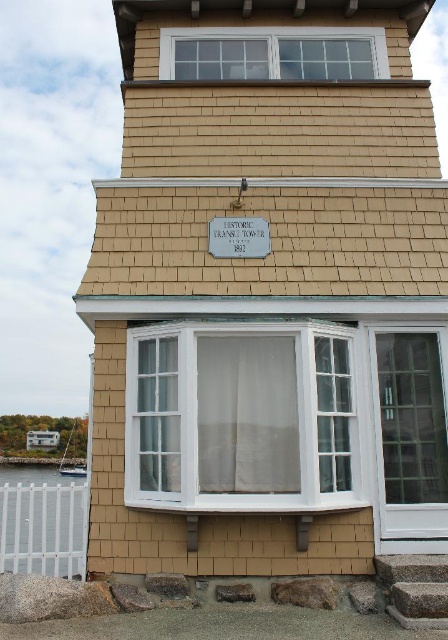
Question: Is white glass window at upper center to the left of white plastic fence at lower left from the viewer's perspective?

Choices:
 (A) no
 (B) yes

Answer: (A)

Question: Is white glass window at center bigger than white plastic fence at lower left?

Choices:
 (A) yes
 (B) no

Answer: (B)

Question: Which of the following is the closest to the observer?

Choices:
 (A) (276, 33)
 (B) (142, 477)
 (C) (72, 568)

Answer: (C)

Question: Does white glass window at center have a larger size compared to white plastic fence at lower left?

Choices:
 (A) no
 (B) yes

Answer: (A)

Question: Which object is the farthest from the white plastic fence at lower left?

Choices:
 (A) white glass window at upper center
 (B) white glass window at center

Answer: (A)

Question: Which object is closer to the camera taking this photo?

Choices:
 (A) white plastic fence at lower left
 (B) white glass window at upper center
 (C) white glass window at center

Answer: (C)